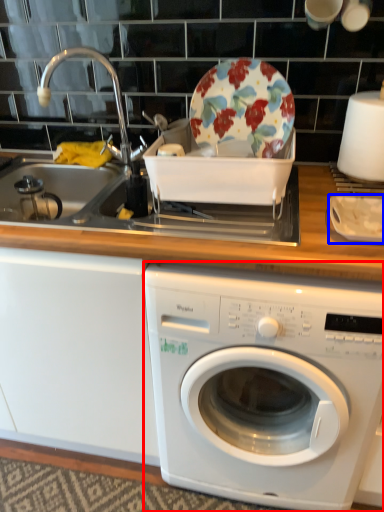
Question: Among these objects, which one is nearest to the camera, washing machine (highlighted by a red box) or tableware (highlighted by a blue box)?

Choices:
 (A) washing machine
 (B) tableware

Answer: (A)